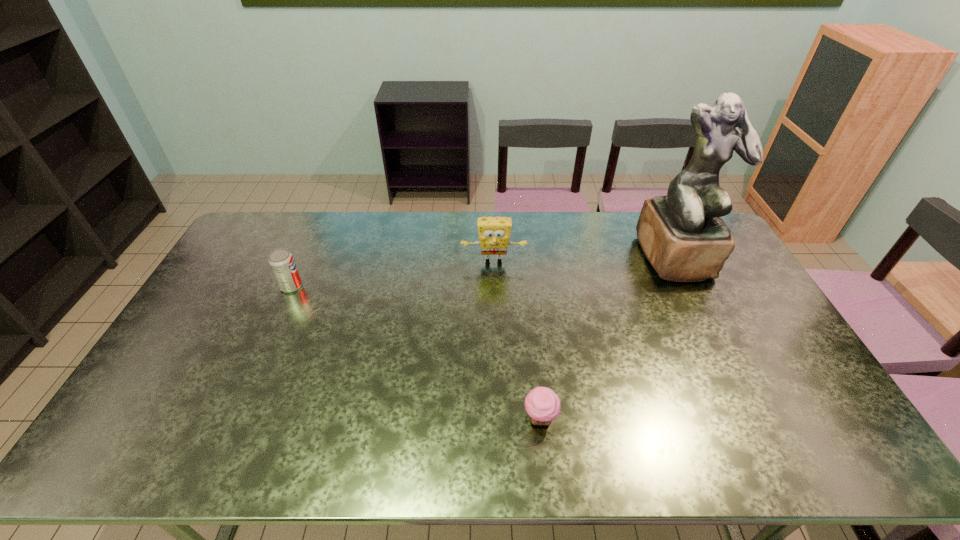
Find the location of a particular element. The image size is (960, 540). empty location between the third shortest object and the soda is located at coordinates pos(393,274).

Locate which object is the closest to the second shortest object. Please provide its 2D coordinates. Your answer should be formatted as a tuple, i.e. [(x, y)], where the tuple contains the x and y coordinates of a point satisfying the conditions above.

[(494, 232)]

I want to click on object that can be found as the third closest to the sponge, so click(x=281, y=261).

This screenshot has width=960, height=540. In order to click on free region that satisfies the following two spatial constraints: 1. on the face of the sponge; 2. on the left side of the cupcake in this screenshot , I will do `click(499, 418)`.

The height and width of the screenshot is (540, 960). In order to click on free space that satisfies the following two spatial constraints: 1. on the face of the shortest object; 2. on the left side of the sponge in this screenshot , I will do `click(499, 418)`.

Image resolution: width=960 pixels, height=540 pixels. Find the location of `free space that satisfies the following two spatial constraints: 1. on the face of the sponge; 2. on the left side of the nearest object`. free space that satisfies the following two spatial constraints: 1. on the face of the sponge; 2. on the left side of the nearest object is located at coordinates (499, 418).

This screenshot has height=540, width=960. I want to click on free spot that satisfies the following two spatial constraints: 1. on the front side of the shortest object; 2. on the right side of the leftmost object, so click(232, 418).